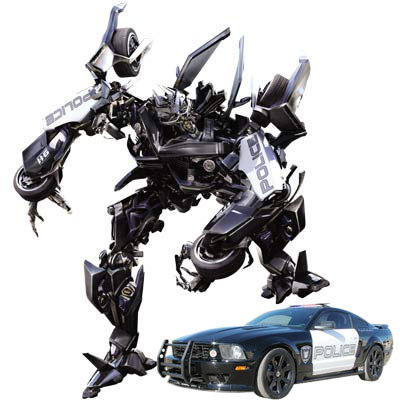
I want to click on door, so click(329, 339).